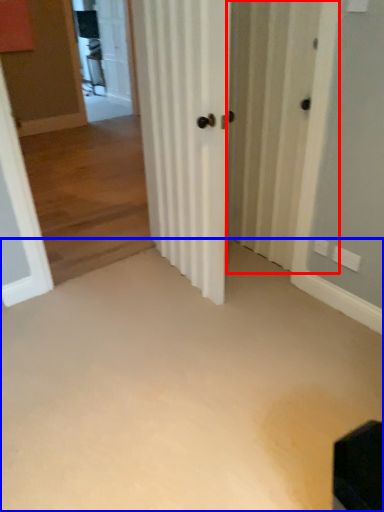
Question: Which point is further to the camera, screen door (highlighted by a red box) or corridor (highlighted by a blue box)?

Choices:
 (A) screen door
 (B) corridor

Answer: (A)